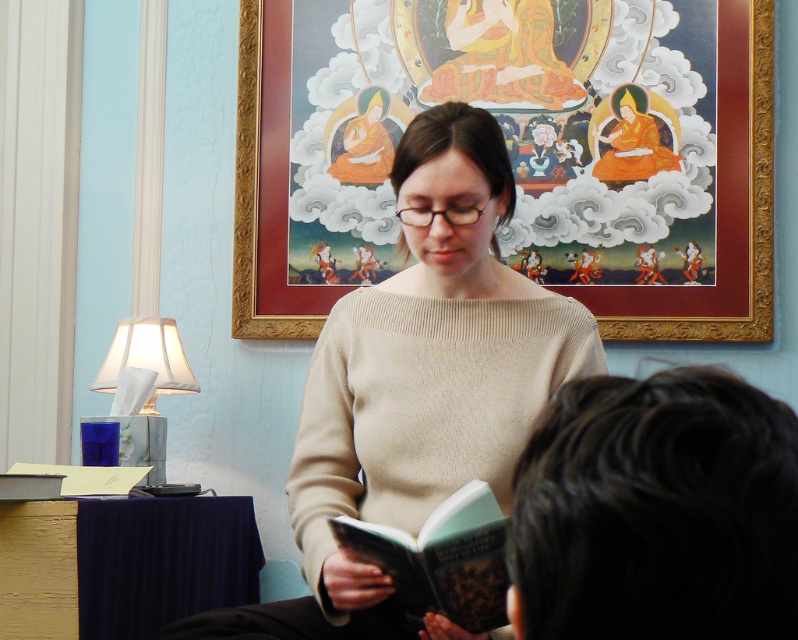
Can you confirm if beige knitted sweater at center is smaller than white fabric lampshade at left?

Incorrect, beige knitted sweater at center is not smaller in size than white fabric lampshade at left.

In the scene shown: Is beige knitted sweater at center bigger than white fabric lampshade at left?

Indeed, beige knitted sweater at center has a larger size compared to white fabric lampshade at left.

Who is more distant from viewer, [358,292] or [184,360]?

Point [184,360]

The height and width of the screenshot is (640, 798). Find the location of `beige knitted sweater at center`. beige knitted sweater at center is located at coordinates (417, 385).

Who is positioned more to the left, gold-framed picture at upper center or beige knitted sweater at center?

beige knitted sweater at center

Is point (373, 1) positioned before point (385, 317)?

No, (373, 1) is further to viewer.

The width and height of the screenshot is (798, 640). In order to click on gold-framed picture at upper center in this screenshot , I will do `click(516, 152)`.

How much distance is there between beige knitted sweater at center and hardcover book at center?

A distance of 11.31 inches exists between beige knitted sweater at center and hardcover book at center.

Between beige knitted sweater at center and hardcover book at center, which one is positioned higher?

beige knitted sweater at center is higher up.

The height and width of the screenshot is (640, 798). Identify the location of beige knitted sweater at center. (417, 385).

Locate an element on the screen. Image resolution: width=798 pixels, height=640 pixels. beige knitted sweater at center is located at coordinates (417, 385).